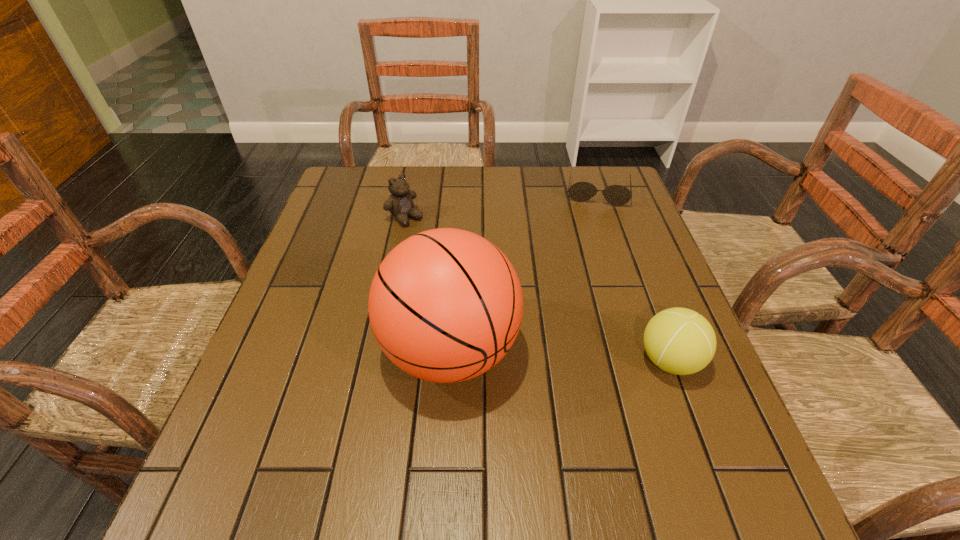
Identify the location of blank space at the left edge of the desktop. The image size is (960, 540). coord(342,243).

Find the location of a particular element. The height and width of the screenshot is (540, 960). free point at the right edge is located at coordinates (627, 233).

Where is `vacant space at the far left corner of the desktop`? The height and width of the screenshot is (540, 960). vacant space at the far left corner of the desktop is located at coordinates (334, 180).

Find the location of a particular element. free space at the far right corner of the desktop is located at coordinates (592, 178).

Where is `vacant space at the near right corner of the desktop`? Image resolution: width=960 pixels, height=540 pixels. vacant space at the near right corner of the desktop is located at coordinates (728, 414).

At what (x,y) coordinates should I click in order to perform the action: click on vacant point located between the teddy bear and the sunglasses. Please return your answer as a coordinate pair (x, y). This screenshot has width=960, height=540. Looking at the image, I should click on tap(501, 205).

Locate an element on the screen. This screenshot has height=540, width=960. vacant area that lies between the tennis ball and the shortest object is located at coordinates (634, 276).

Find the location of `vacant space that is in between the tennis ball and the shortest object`. vacant space that is in between the tennis ball and the shortest object is located at coordinates (634, 276).

This screenshot has width=960, height=540. Find the location of `free space that is in between the teddy bear and the tennis ball`. free space that is in between the teddy bear and the tennis ball is located at coordinates (538, 289).

Image resolution: width=960 pixels, height=540 pixels. Identify the location of free space between the sunglasses and the tallest object. (524, 272).